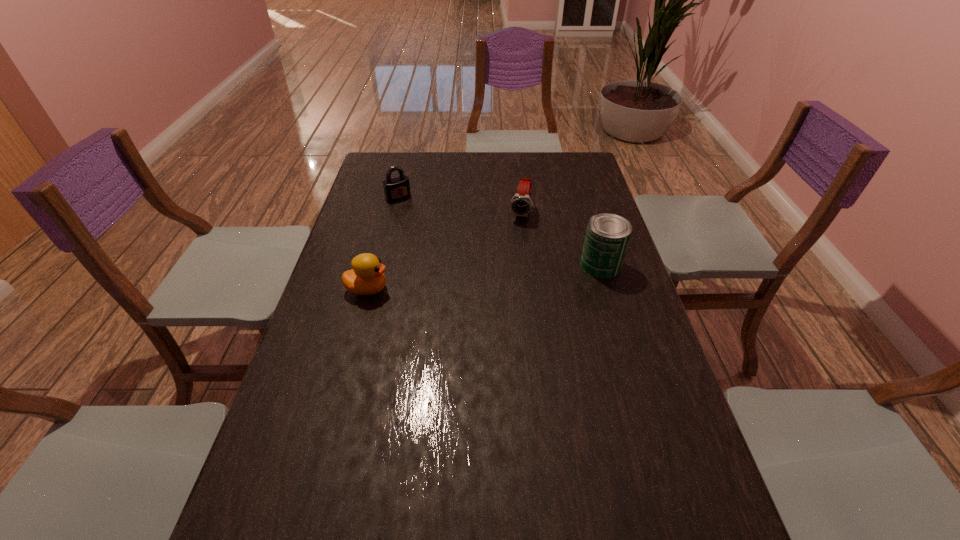
Find the location of a particular element. The image size is (960, 540). duckling is located at coordinates (366, 278).

Find the location of a particular element. Image resolution: width=960 pixels, height=540 pixels. the second nearest object is located at coordinates (607, 236).

Where is `the tallest object`? The image size is (960, 540). the tallest object is located at coordinates (607, 236).

Locate an element on the screen. This screenshot has width=960, height=540. padlock is located at coordinates (397, 188).

The height and width of the screenshot is (540, 960). What are the coordinates of `watch` in the screenshot? It's located at (521, 205).

Locate an element on the screen. Image resolution: width=960 pixels, height=540 pixels. the second object from right to left is located at coordinates (521, 205).

Identify the location of vacant space located 0.140m on the face of the nearest object. (438, 289).

Where is `free space located on the left of the third farthest object`? free space located on the left of the third farthest object is located at coordinates (522, 265).

This screenshot has width=960, height=540. I want to click on vacant area situated 0.390m on the front of the farthest object near the keyhole, so click(x=450, y=263).

Identify the location of vacant region located on the front of the farthest object near the keyhole. (421, 226).